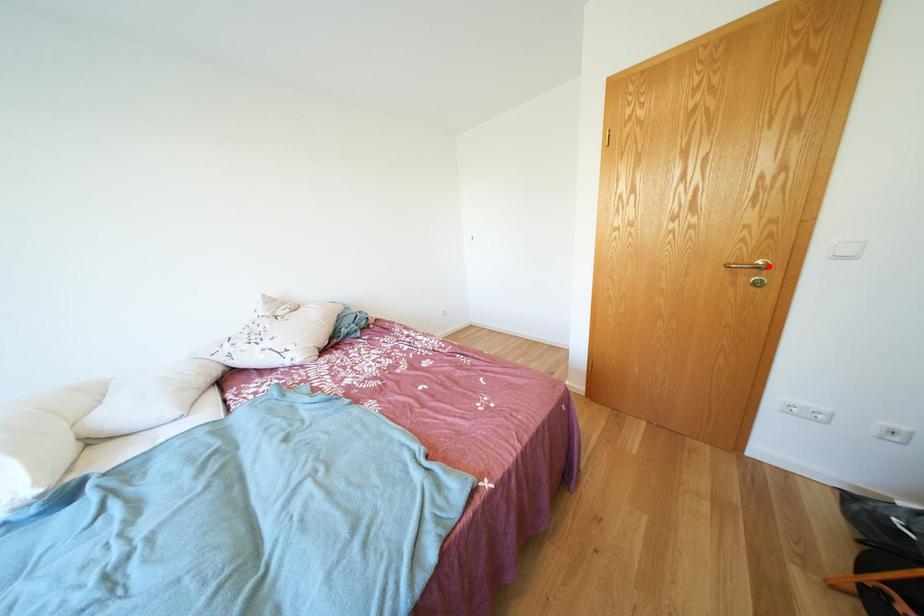
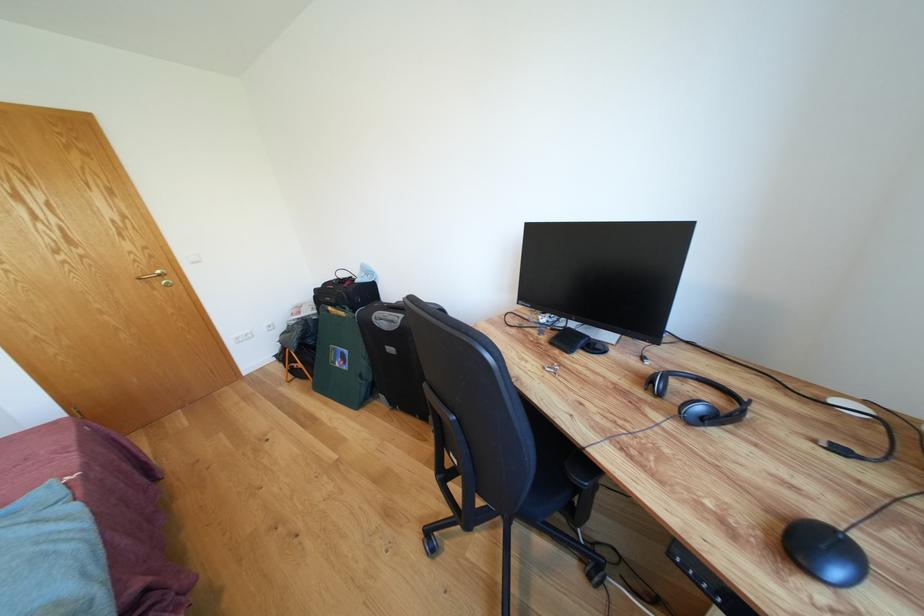
The point at the highlighted location is marked in the first image. Where is the corresponding point in the second image?

(167, 277)